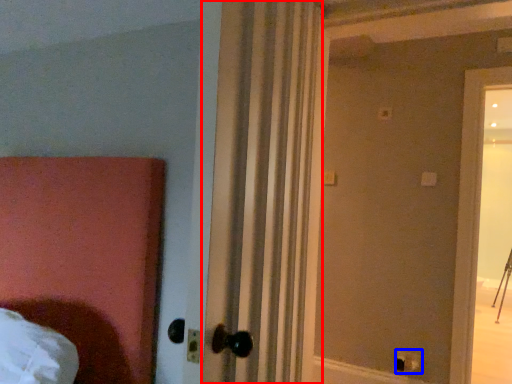
Question: Which of the following is the farthest to the observer, curtain (highlighted by a red box) or electric outlet (highlighted by a blue box)?

Choices:
 (A) curtain
 (B) electric outlet

Answer: (B)